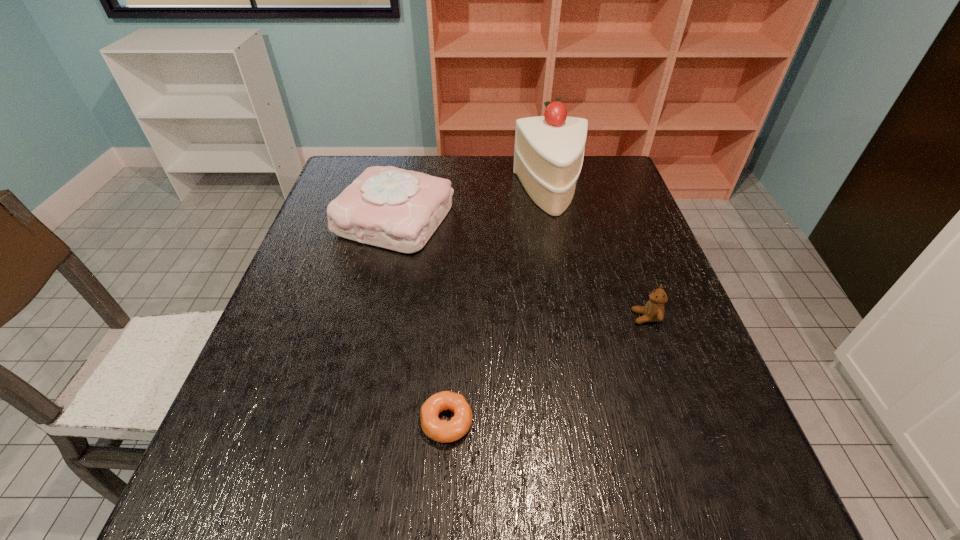
You are a GUI agent. You are given a task and a screenshot of the screen. Output one action in this format:
    pyautogui.click(x=<x>, y=<y>)
    Task: Click on the empty space that is in between the second nearest object and the second object from right to left
    
    Given the screenshot: What is the action you would take?
    pyautogui.click(x=598, y=255)

Identify the location of vacant point located between the shorter cake and the second nearest object. The width and height of the screenshot is (960, 540). (520, 268).

Where is `empty space that is in between the second tallest object and the shortest object`? The height and width of the screenshot is (540, 960). empty space that is in between the second tallest object and the shortest object is located at coordinates (421, 320).

Where is `free space between the teddy bear and the nearest object`? Image resolution: width=960 pixels, height=540 pixels. free space between the teddy bear and the nearest object is located at coordinates (546, 369).

Locate an element on the screen. vacant area that lies between the doughnut and the second nearest object is located at coordinates (546, 369).

Locate which object is the second closest to the second tallest object. Please provide its 2D coordinates. Your answer should be formatted as a tuple, i.e. [(x, y)], where the tuple contains the x and y coordinates of a point satisfying the conditions above.

[(443, 431)]

Identify which object is the second nearest to the third object from left to right. Please provide its 2D coordinates. Your answer should be formatted as a tuple, i.e. [(x, y)], where the tuple contains the x and y coordinates of a point satisfying the conditions above.

[(653, 311)]